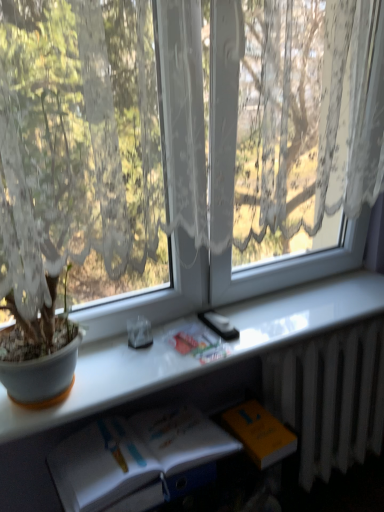
This screenshot has width=384, height=512. I want to click on vacant space underneath transparent lace curtain at upper center (from a real-world perspective), so coord(235,312).